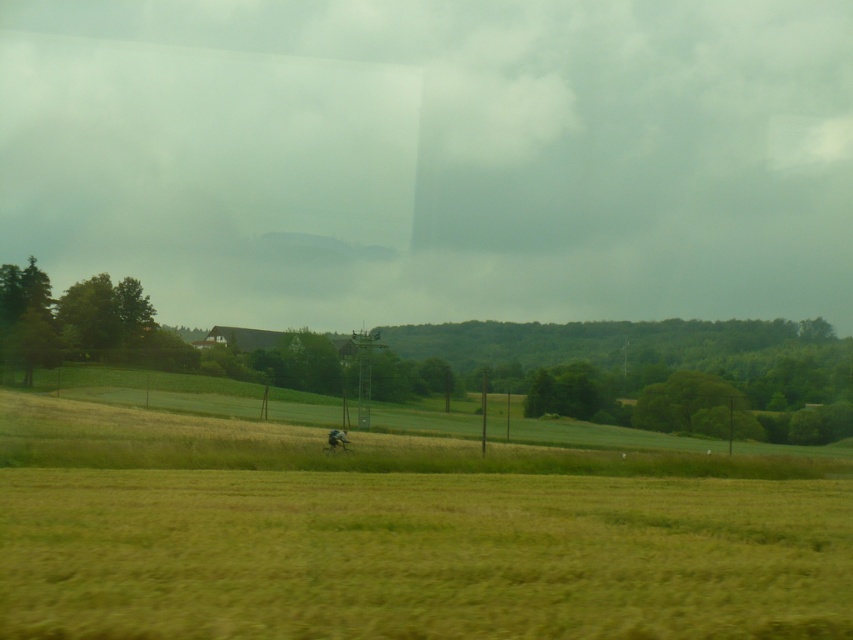
Is green grassy field at center positioned behind brown fur dog at center?

No, green grassy field at center is closer to the viewer.

Who is more distant from viewer, (270, 490) or (329, 435)?

The point (329, 435) is behind.

Find the location of a particular element. green grassy field at center is located at coordinates (399, 534).